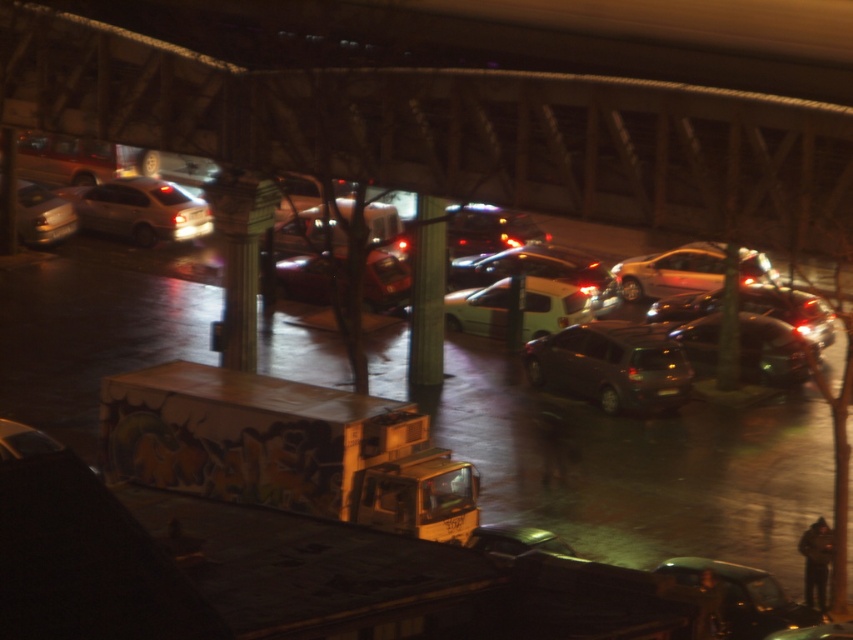
Question: Is shiny metallic sedan at right closer to the viewer compared to shiny black car at lower center?

Choices:
 (A) no
 (B) yes

Answer: (A)

Question: Which object is closer to the camera taking this photo?

Choices:
 (A) shiny silver sedan at center-right
 (B) shiny black car at lower center
 (C) matte white van at center

Answer: (B)

Question: Considering the relative positions of shiny silver sedan at center-right and shiny red car at center in the image provided, where is shiny silver sedan at center-right located with respect to shiny red car at center?

Choices:
 (A) above
 (B) below

Answer: (A)

Question: Which point is farther to the camera?

Choices:
 (A) [657, 376]
 (B) [379, 236]

Answer: (B)

Question: Estimate the real-world distances between objects in this image. Which object is closer to the shiny black car at lower right?

Choices:
 (A) shiny red car at center
 (B) shiny silver sedan at left
 (C) shiny metallic car at center

Answer: (A)

Question: Does concrete bridge at center lie behind shiny black car at lower right?

Choices:
 (A) no
 (B) yes

Answer: (B)